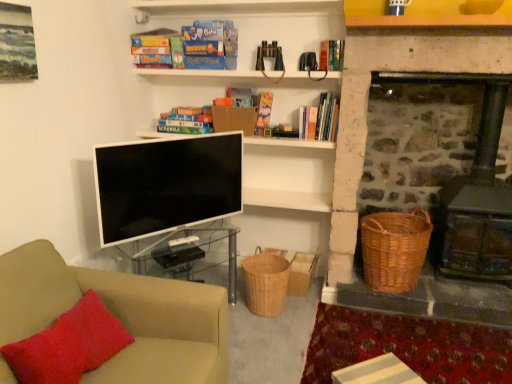
Question: Relative to blue cardboard game at upper center, which is the 3th book from right to left, is white striped wood table at lower center in front or behind?

Choices:
 (A) behind
 (B) front

Answer: (B)

Question: Is point [385, 370] closer or farther from the camera than point [162, 39]?

Choices:
 (A) farther
 (B) closer

Answer: (B)

Question: Which object is the closest to the dark brown wood stove at right?

Choices:
 (A) woven brown basket at lower center, positioned as the second basket in right-to-left order
 (B) blue cardboard game at upper center, the third book from the left
 (C) matte cardboard book at upper center, acting as the 2th book starting from the right
 (D) beige fabric couch at lower left
 (E) woven brown basket at right, the 1th basket in the right-to-left sequence

Answer: (E)

Question: Which of these objects is positioned farthest from the matte cardboard book at upper center, acting as the 2th book starting from the right?

Choices:
 (A) beige fabric couch at lower left
 (B) white striped paper at lower right
 (C) woven brown basket at lower center, positioned as the second basket in right-to-left order
 (D) white glossy television at center
 (E) matte cardboard book at upper center, arranged as the 5th book when viewed from the right

Answer: (A)